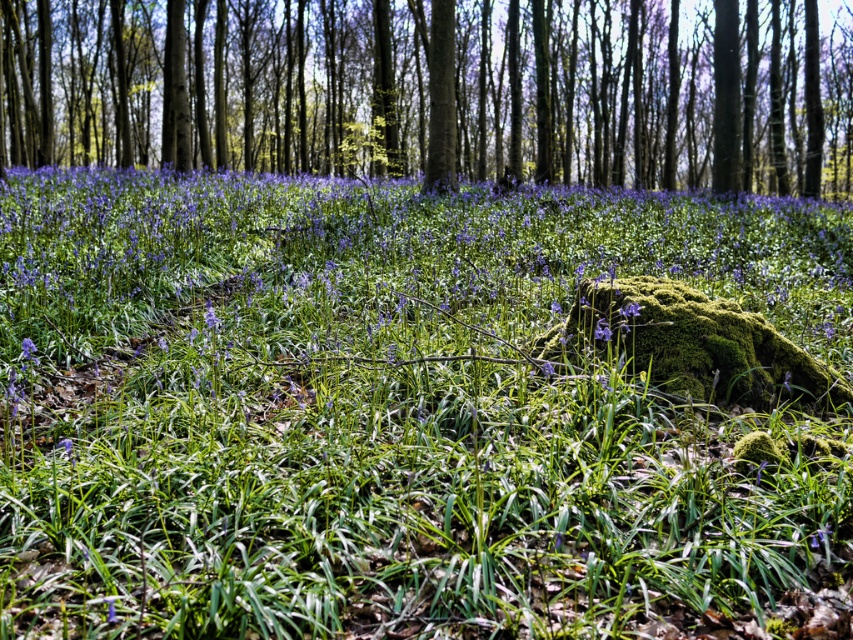
Measure the distance between green grass at center and purple matte flower at center.

3.97 meters

Does green grass at center have a smaller size compared to purple matte flower at center?

No, green grass at center is not smaller than purple matte flower at center.

The image size is (853, 640). In order to click on green grass at center in this screenshot , I will do `click(398, 413)`.

Is point (447, 548) positioned after point (724, 371)?

No, it is not.

Between green grass at center and green mossy rock at center-right, which one is positioned lower?

green mossy rock at center-right

Where is `green grass at center`? The width and height of the screenshot is (853, 640). green grass at center is located at coordinates (398, 413).

Between green mossy rock at center and purple matte flower at lower left, which one is positioned higher?

Positioned higher is green mossy rock at center.

Between green mossy rock at center and purple matte flower at lower left, which one is positioned lower?

purple matte flower at lower left is lower down.

Between point (299, 113) and point (28, 355), which one is positioned in front?

Positioned in front is point (28, 355).

Where is `green mossy rock at center`? This screenshot has width=853, height=640. green mossy rock at center is located at coordinates (434, 90).